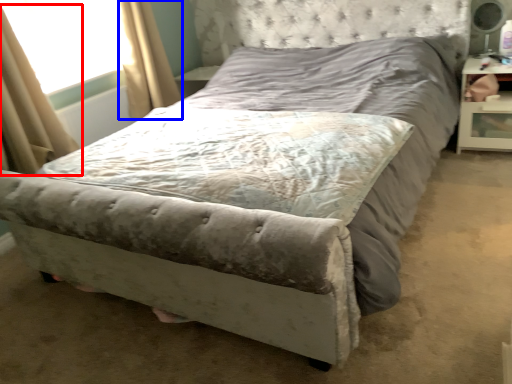
Question: Which point is closer to the camera, curtain (highlighted by a red box) or curtain (highlighted by a blue box)?

Choices:
 (A) curtain
 (B) curtain

Answer: (A)